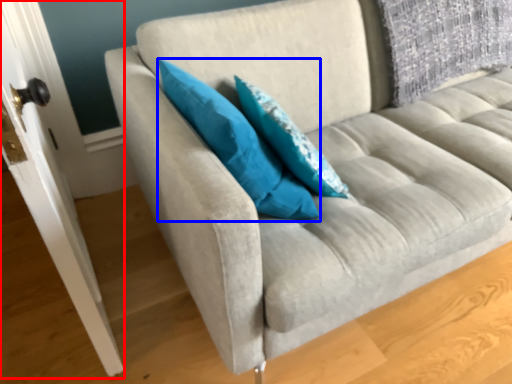
Question: Which object appears closest to the camera in this image, door (highlighted by a red box) or pillow (highlighted by a blue box)?

Choices:
 (A) door
 (B) pillow

Answer: (A)